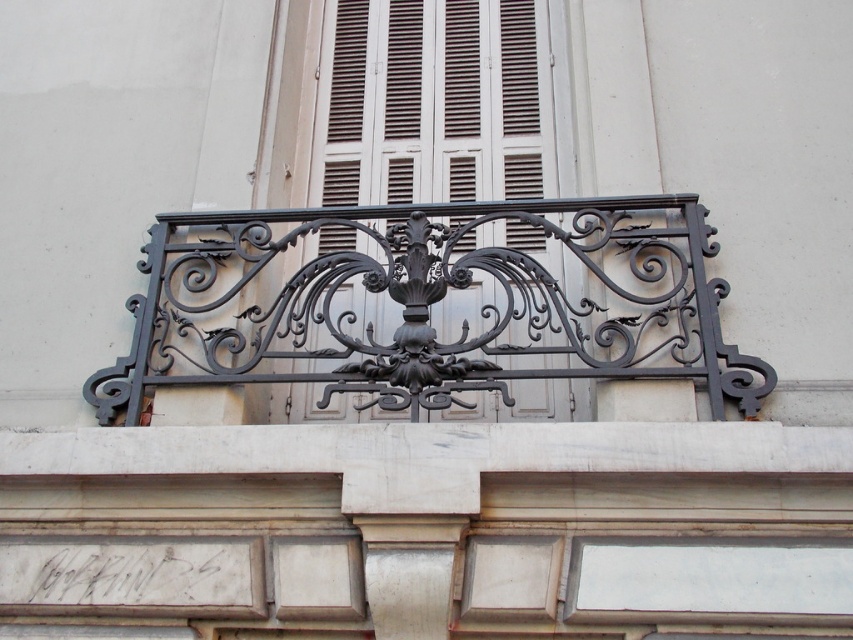
Question: Is black wrought iron balustrade at center behind brown matte shutter at center?

Choices:
 (A) yes
 (B) no

Answer: (B)

Question: Can you confirm if black wrought iron balustrade at center is thinner than brown matte shutter at center?

Choices:
 (A) yes
 (B) no

Answer: (B)

Question: Which object appears farthest from the camera in this image?

Choices:
 (A) brown matte shutter at center
 (B) black wrought iron balustrade at center

Answer: (A)

Question: Which object appears closest to the camera in this image?

Choices:
 (A) brown matte shutter at center
 (B) black wrought iron balustrade at center

Answer: (B)

Question: In this image, where is black wrought iron balustrade at center located relative to brown matte shutter at center?

Choices:
 (A) below
 (B) above

Answer: (A)